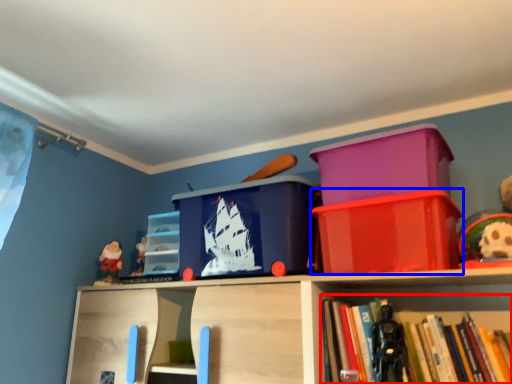
Question: Among these objects, which one is nearest to the camera, book (highlighted by a red box) or storage box (highlighted by a blue box)?

Choices:
 (A) book
 (B) storage box

Answer: (A)